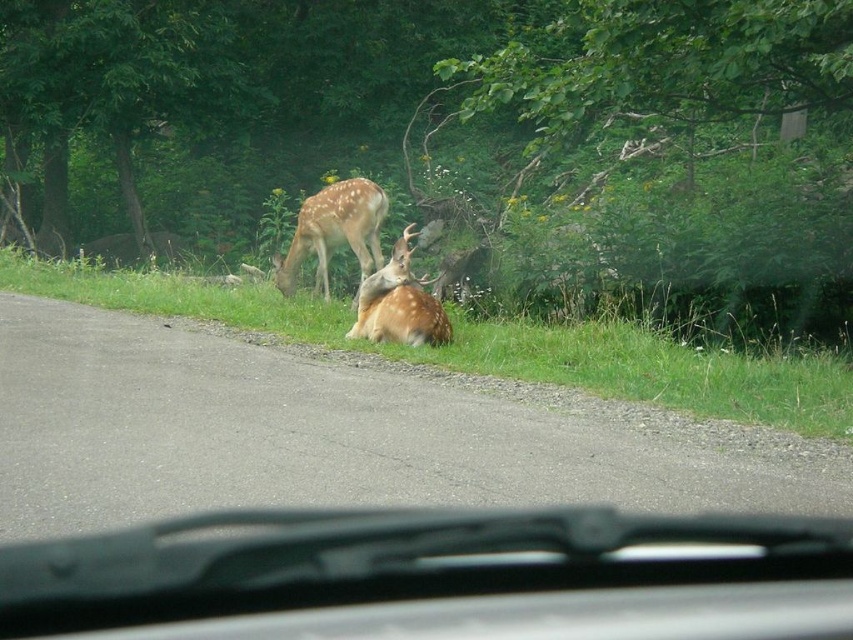
You are driving a car and see the green grass at lower center and the fawn fur antlers at center through the windshield. Can you estimate which one is wider from your viewpoint?

The green grass at lower center is wider than the fawn fur antlers at center according to the description.

Consider the image. You are driving a car and see the green grass at lower center through the windshield. Based on its position, can you estimate whether it is on the road or the roadside?

The green grass at lower center is located at point [492,346], which corresponds to the roadside area, so it is likely on the roadside.

You are driving a car and see the scene through the windshield. There is a point marked at coordinates (335, 230). What does this point represent?

The point at coordinates (335, 230) indicates the location of the spotted fur deer at center.